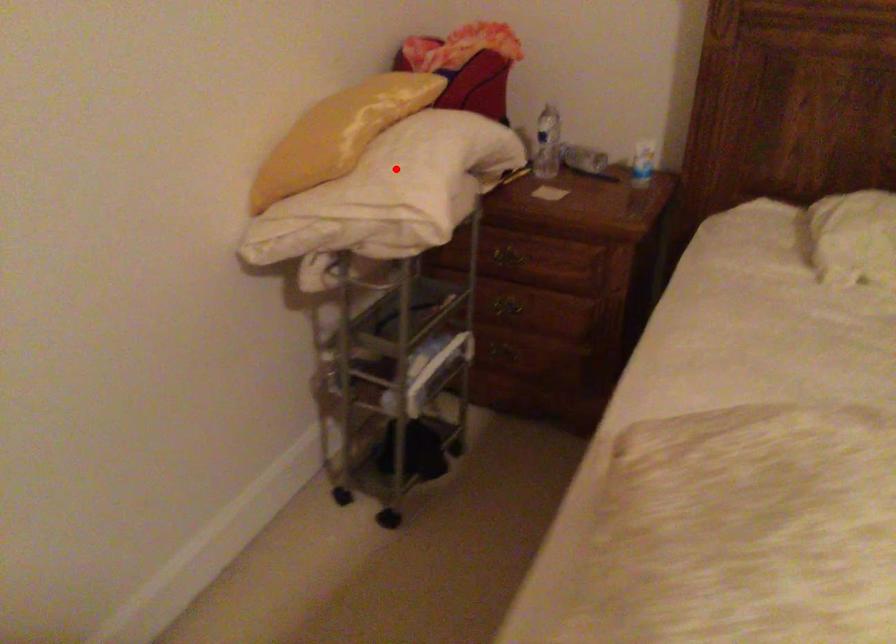
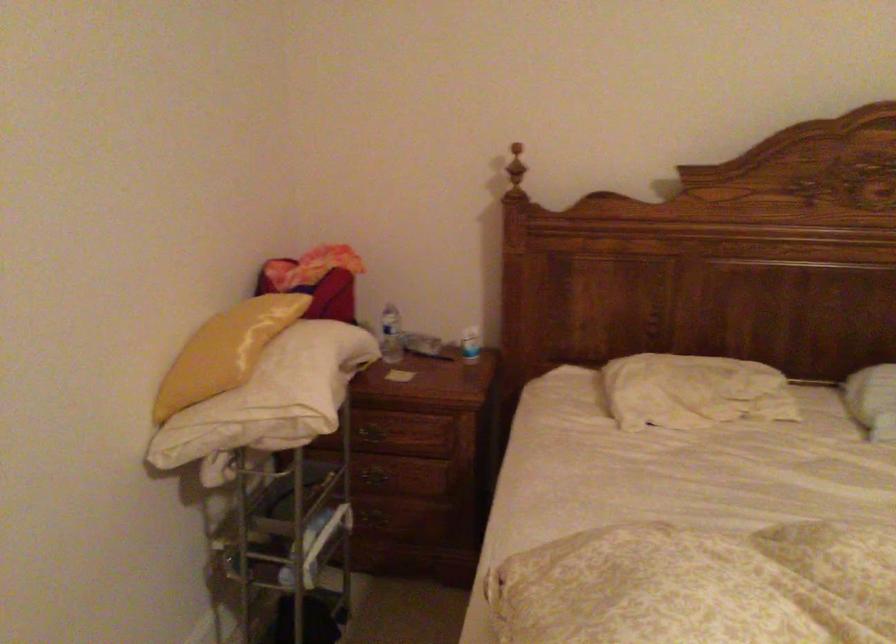
The point at the highlighted location is marked in the first image. Where is the corresponding point in the second image?

(287, 375)